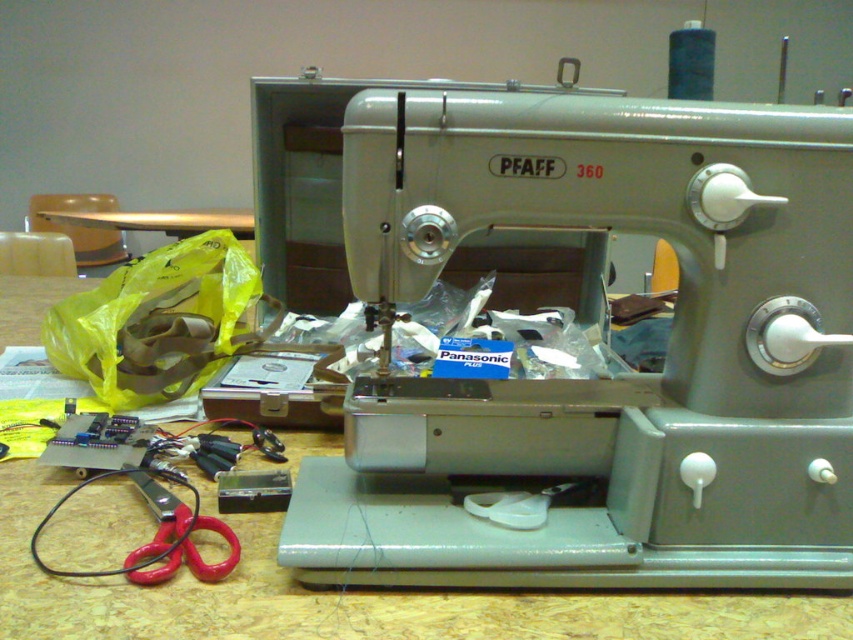
Which is more to the right, metallic gray sewing machine at center or metallic gold table at upper left?

metallic gray sewing machine at center

Which is behind, point (788, 214) or point (187, 232)?

The point (187, 232) is more distant.

Locate an element on the screen. This screenshot has height=640, width=853. metallic gray sewing machine at center is located at coordinates (601, 380).

Who is more distant from viewer, (718, 112) or (173, 509)?

Point (173, 509)

Measure the distance between metallic gray sewing machine at center and red plastic scissors at lower left.

12.29 inches

Is point (849, 216) less distant than point (193, 570)?

Yes.

Find the location of a particular element. This screenshot has height=640, width=853. metallic gray sewing machine at center is located at coordinates (601, 380).

Who is more forward, (173, 525) or (170, 232)?

Positioned in front is point (173, 525).

The width and height of the screenshot is (853, 640). What do you see at coordinates (177, 538) in the screenshot?
I see `red plastic scissors at lower left` at bounding box center [177, 538].

Describe the element at coordinates (177, 538) in the screenshot. I see `red plastic scissors at lower left` at that location.

Where is `red plastic scissors at lower left`? The width and height of the screenshot is (853, 640). red plastic scissors at lower left is located at coordinates (177, 538).